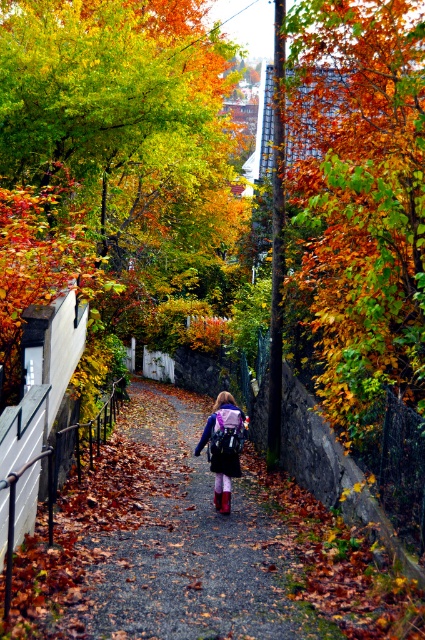
You are a hiker who wants to place a matte purple backpack at center on top of the shiny orange leaves at upper center. Will the backpack fit without overlapping the leaves?

The shiny orange leaves at upper center is bigger than the matte purple backpack at center, so the backpack will fit without overlapping the leaves.

You are standing at the entrance of the autumn pathway and see the point marked at coordinates [124,116]. What is located at that point?

The point at [124,116] indicates shiny orange leaves at upper center.